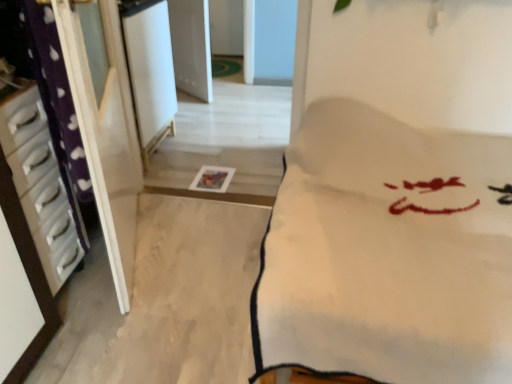
Locate an element on the screen. Image resolution: width=512 pixels, height=384 pixels. vacant area located to the right-hand side of white glossy screen door at upper center is located at coordinates (205, 151).